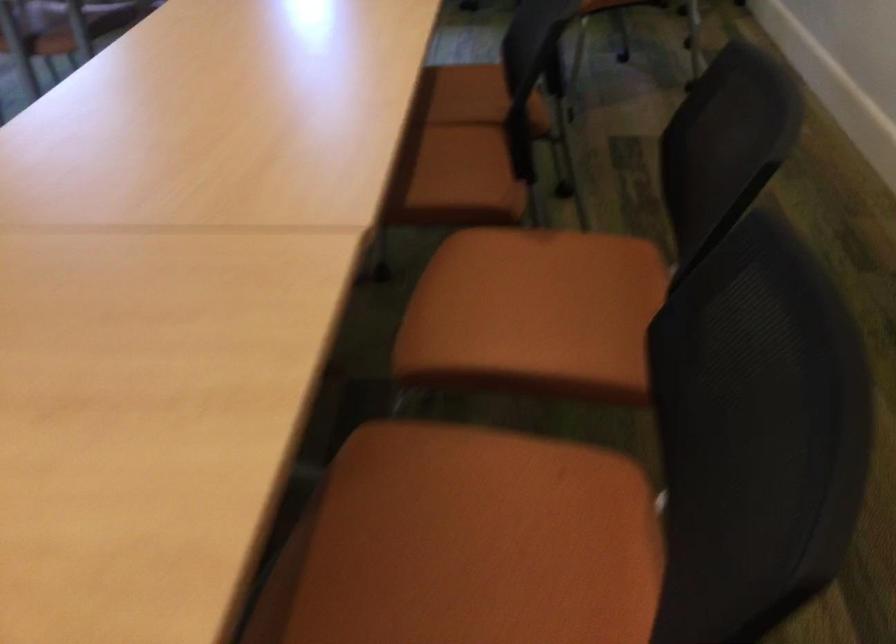
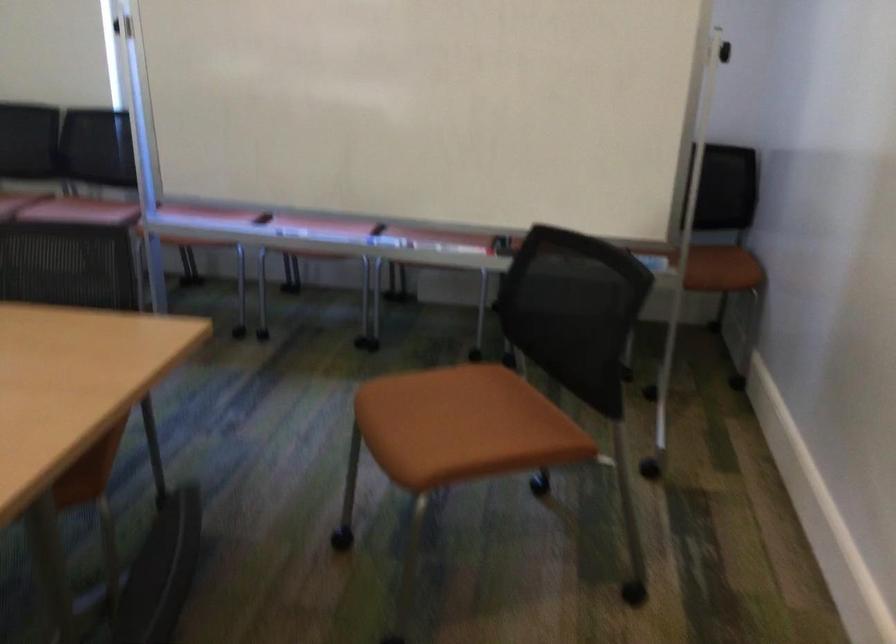
The images are taken continuously from a first-person perspective. In which direction is your viewpoint rotating?

The camera rotated toward right-down.